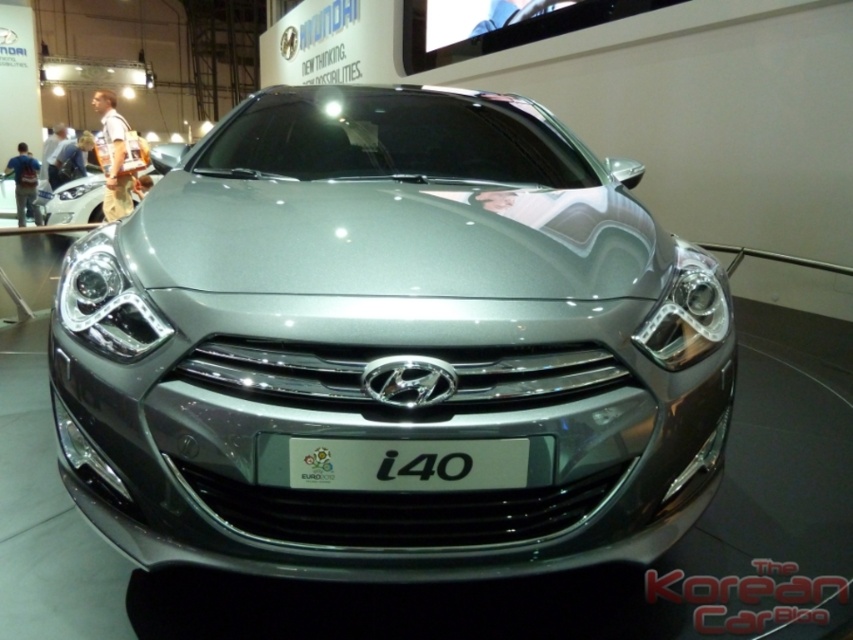
Question: Does white metallic license plate at center appear over chrome metallic headlight at left?

Choices:
 (A) no
 (B) yes

Answer: (A)

Question: Can you confirm if satin silver car at center is smaller than white metallic license plate at center?

Choices:
 (A) yes
 (B) no

Answer: (B)

Question: Estimate the real-world distances between objects in this image. Which object is closer to the chrome metallic headlight at left?

Choices:
 (A) sleek chrome headlight at center
 (B) satin silver car at center

Answer: (B)

Question: Which object is farther from the camera taking this photo?

Choices:
 (A) satin silver car at center
 (B) white metallic license plate at center
 (C) sleek chrome headlight at center
 (D) chrome metallic headlight at left

Answer: (C)

Question: Can you confirm if sleek chrome headlight at center is positioned above satin silver car at left?

Choices:
 (A) yes
 (B) no

Answer: (B)

Question: Which object is the closest to the white metallic license plate at center?

Choices:
 (A) satin silver car at left
 (B) satin silver car at center

Answer: (B)